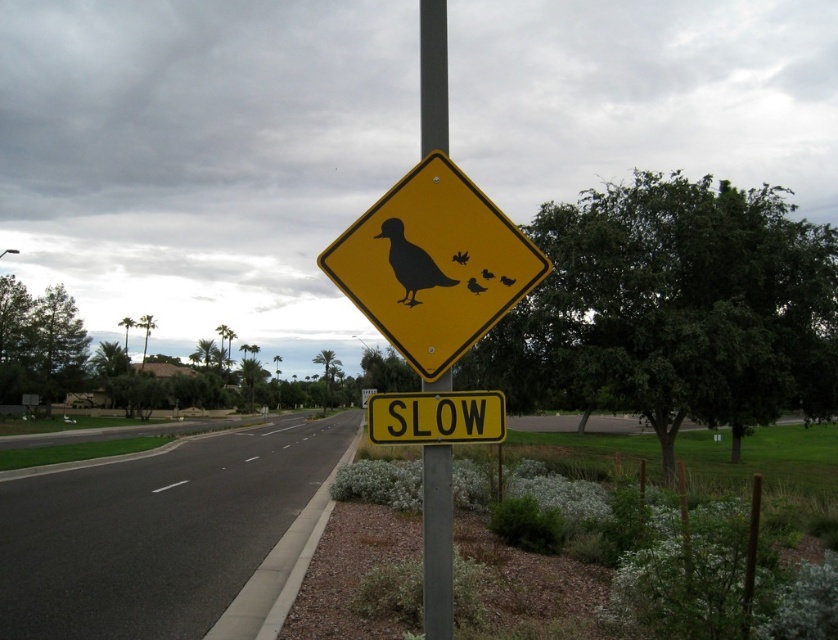
You are a driver approaching the road with two black matte birds visible. You see the black matte duck at center and the black matte bird at upper center. Which one is positioned to the left of the other?

The black matte duck at center is to the left of the black matte bird at upper center.

You are a pedestrian crossing the road and see two matte black duck signs. One is labeled as matte black duck at center and the other as black matte duck at upper center. Which duck sign is positioned to the left when facing the road?

The matte black duck at center is positioned to the left of the black matte duck at upper center.

You are a driver approaching the road with the matte black duck at center. Based on the road signs and the duck location, what should you do?

The matte black duck at center is located at point (474,285), which is on the road. The yellow diamond sign warns of wildlife crossing, and the SLOW sign instructs drivers to reduce speed. Therefore, you should slow down and be prepared to stop if ducks are crossing the road.